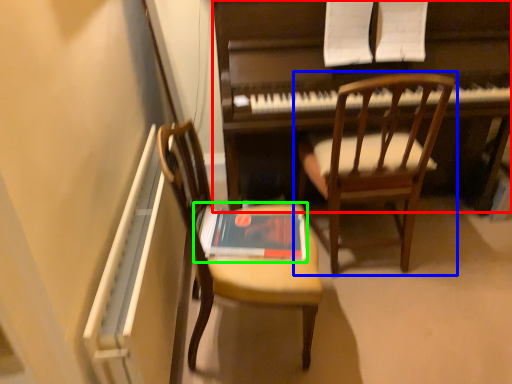
Question: Based on their relative distances, which object is nearer to piano (highlighted by a red box)? Choose from chair (highlighted by a blue box) and paperback book (highlighted by a green box).

Choices:
 (A) chair
 (B) paperback book

Answer: (A)